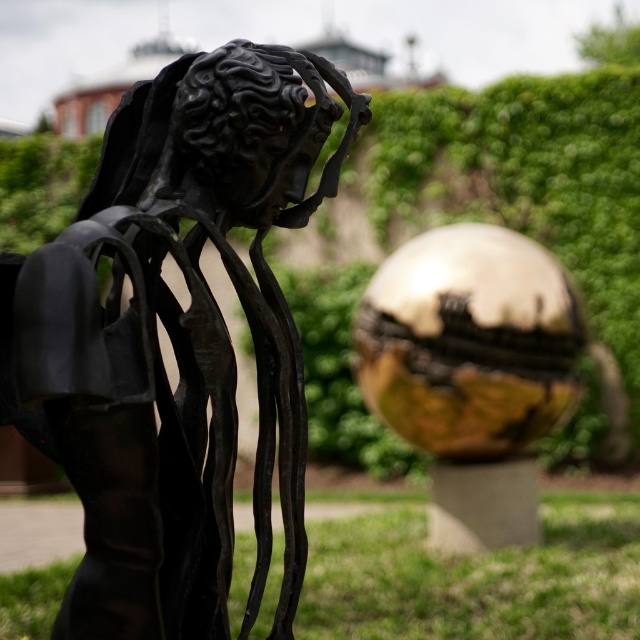
Question: Which point appears farthest from the camera in this image?

Choices:
 (A) (552, 195)
 (B) (125, 236)
 (C) (349, 621)

Answer: (A)

Question: Is green leafy hedge at upper center above green grass at lower right?

Choices:
 (A) yes
 (B) no

Answer: (A)

Question: Which of the following is the closest to the observer?

Choices:
 (A) (129, 230)
 (B) (528, 554)

Answer: (A)

Question: Which point is farther to the camera?

Choices:
 (A) (625, 113)
 (B) (264, 604)

Answer: (A)

Question: In this image, where is green leafy hedge at upper center located relative to green grass at lower right?

Choices:
 (A) below
 (B) above

Answer: (B)

Question: In this image, where is black matte sculpture at left located relative to green grass at lower right?

Choices:
 (A) above
 (B) below

Answer: (A)